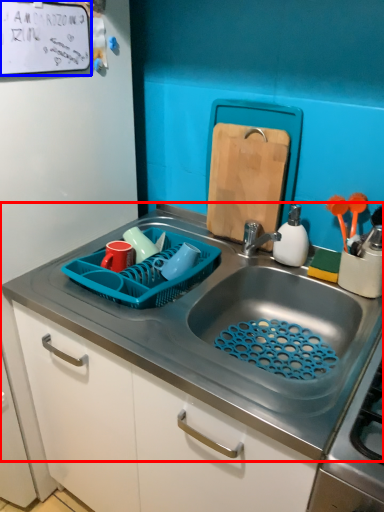
Question: Which object is further to the camera taking this photo, sink (highlighted by a red box) or bulletin board (highlighted by a blue box)?

Choices:
 (A) sink
 (B) bulletin board

Answer: (B)